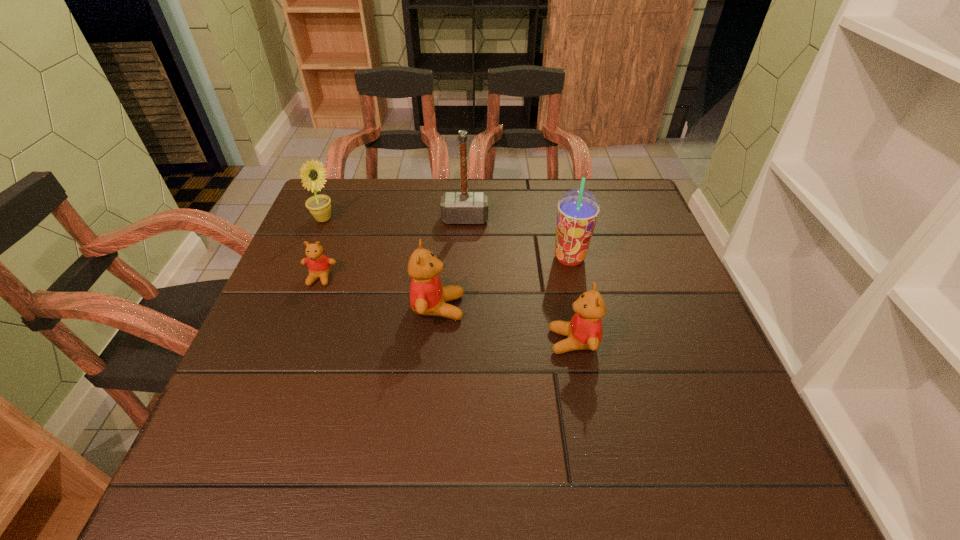
Identify which teddy bear is the closest to the second teddy bear from right to left. Please provide its 2D coordinates. Your answer should be formatted as a tuple, i.e. [(x, y)], where the tuple contains the x and y coordinates of a point satisfying the conditions above.

[(584, 331)]

Find the location of a particular element. This screenshot has height=540, width=960. teddy bear identified as the second closest to the leftmost teddy bear is located at coordinates (584, 331).

Where is `free location that satisfies the following two spatial constraints: 1. on the striking surface of the hammer; 2. on the face of the sunflower`? The width and height of the screenshot is (960, 540). free location that satisfies the following two spatial constraints: 1. on the striking surface of the hammer; 2. on the face of the sunflower is located at coordinates (466, 219).

Identify the location of free space that satisfies the following two spatial constraints: 1. on the striking surface of the hammer; 2. on the front-facing side of the second teddy bear from right to left. The image size is (960, 540). (462, 307).

The width and height of the screenshot is (960, 540). I want to click on free spot that satisfies the following two spatial constraints: 1. on the striking surface of the hammer; 2. on the face of the sunflower, so click(466, 219).

You are a GUI agent. You are given a task and a screenshot of the screen. Output one action in this format:
    pyautogui.click(x=<x>, y=<y>)
    Task: Click on the free space in the image that satisfies the following two spatial constraints: 1. on the striking surface of the hammer; 2. on the front-facing side of the second teddy bear from left to right
    The width and height of the screenshot is (960, 540).
    Given the screenshot: What is the action you would take?
    pyautogui.click(x=462, y=307)

Locate an element on the screen. The width and height of the screenshot is (960, 540). free location that satisfies the following two spatial constraints: 1. on the striking surface of the hammer; 2. on the front-facing side of the second teddy bear from right to left is located at coordinates pos(462,307).